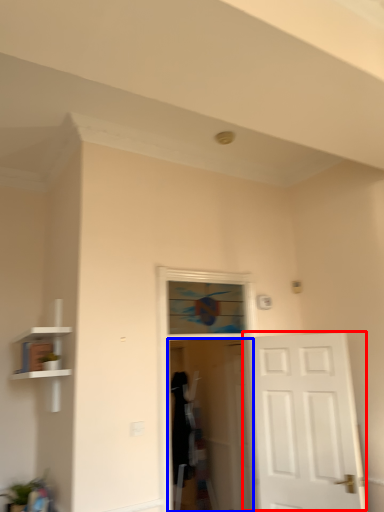
Question: Which object is closer to the camera taking this photo, door (highlighted by a red box) or screen door (highlighted by a blue box)?

Choices:
 (A) door
 (B) screen door

Answer: (A)